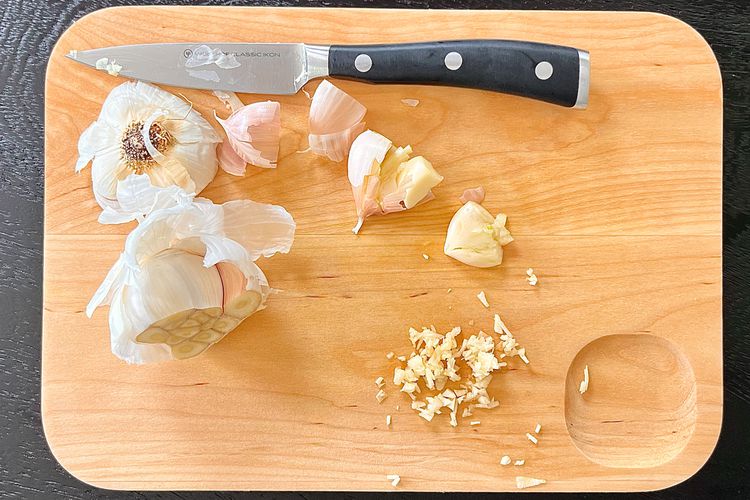
Identify the location of cutting board circle hole. The height and width of the screenshot is (500, 750). (634, 394).